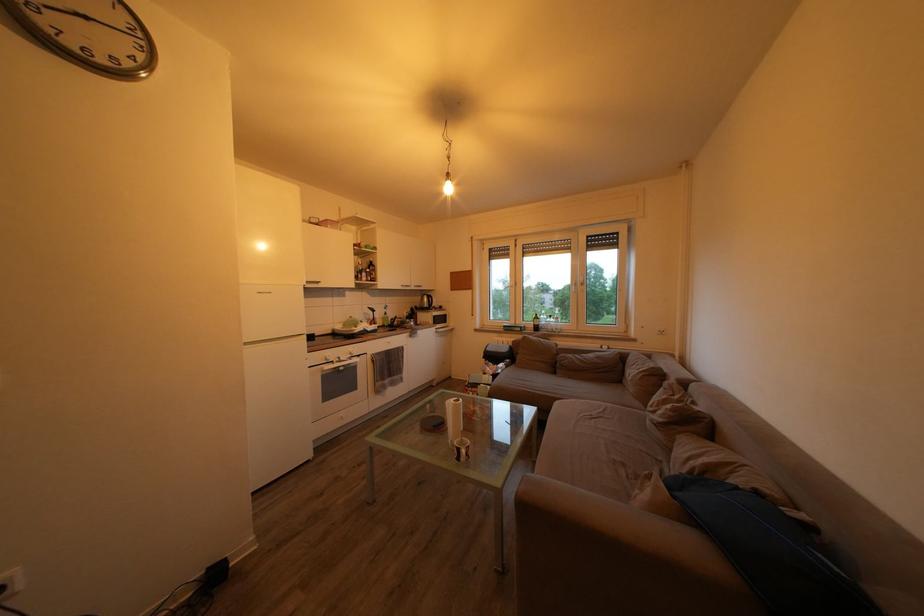
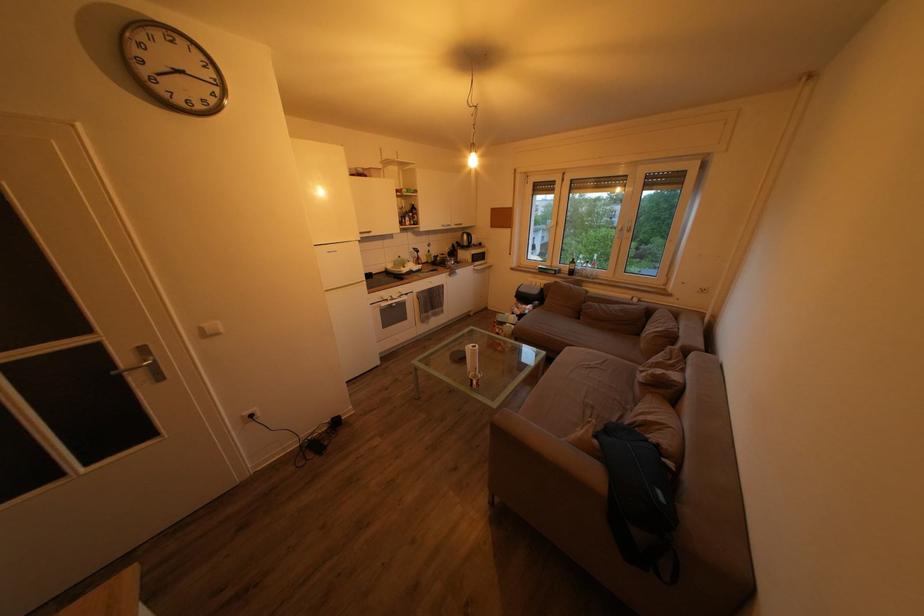
The point at (538, 330) is marked in the first image. Where is the corresponding point in the second image?

(573, 274)